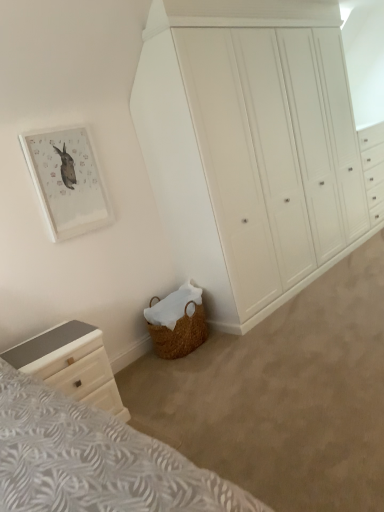
Question: Should I look upward or downward to see white painted wood wardrobe at center, the first chest of drawers viewed from the right?

Choices:
 (A) up
 (B) down

Answer: (A)

Question: From the image's perspective, is white painted wood wardrobe at center, which ranks as the 2th chest of drawers in bottom-to-top order, located above matte white picture frame at upper left?

Choices:
 (A) yes
 (B) no

Answer: (A)

Question: Can you confirm if white painted wood wardrobe at center, which is counted as the 1th chest of drawers, starting from the top, is positioned to the right of matte white picture frame at upper left?

Choices:
 (A) no
 (B) yes

Answer: (B)

Question: Is white painted wood wardrobe at center, which ranks as the 2th chest of drawers in left-to-right order, far from matte white picture frame at upper left?

Choices:
 (A) no
 (B) yes

Answer: (B)

Question: Does white painted wood wardrobe at center, which ranks as the 2th chest of drawers in left-to-right order, lie in front of matte white picture frame at upper left?

Choices:
 (A) no
 (B) yes

Answer: (B)

Question: Is matte white picture frame at upper left surrounded by white painted wood wardrobe at center, which is counted as the 1th chest of drawers, starting from the top?

Choices:
 (A) no
 (B) yes

Answer: (A)

Question: Is white painted wood wardrobe at center, which appears as the 1th chest of drawers when viewed from the back, facing away from matte white picture frame at upper left?

Choices:
 (A) no
 (B) yes

Answer: (A)

Question: Considering the relative sizes of white painted wood wardrobe at center, the first chest of drawers viewed from the right, and white glossy chest of drawers at lower left, arranged as the 2th chest of drawers when viewed from the back, in the image provided, is white painted wood wardrobe at center, the first chest of drawers viewed from the right, shorter than white glossy chest of drawers at lower left, arranged as the 2th chest of drawers when viewed from the back,?

Choices:
 (A) no
 (B) yes

Answer: (A)

Question: From the image's perspective, is white painted wood wardrobe at center, the first chest of drawers viewed from the right, located beneath white glossy chest of drawers at lower left, which is the 1th chest of drawers from front to back?

Choices:
 (A) yes
 (B) no

Answer: (B)

Question: Is white painted wood wardrobe at center, which appears as the 1th chest of drawers when viewed from the back, not close to white glossy chest of drawers at lower left, which is the 1th chest of drawers from front to back?

Choices:
 (A) no
 (B) yes

Answer: (B)

Question: Is white painted wood wardrobe at center, the first chest of drawers viewed from the right, thinner than white glossy chest of drawers at lower left, which ranks as the first chest of drawers in left-to-right order?

Choices:
 (A) yes
 (B) no

Answer: (B)

Question: From the image's perspective, is white painted wood wardrobe at center, placed as the second chest of drawers when sorted from front to back, on top of white glossy chest of drawers at lower left, the 2th chest of drawers from the right?

Choices:
 (A) yes
 (B) no

Answer: (A)

Question: Is white painted wood wardrobe at center, which is counted as the 1th chest of drawers, starting from the top, taller than white glossy chest of drawers at lower left, the 2th chest of drawers from the right?

Choices:
 (A) no
 (B) yes

Answer: (B)

Question: Is white glossy chest of drawers at lower left, which is the 1th chest of drawers from front to back, wider than white painted wood wardrobe at center, which ranks as the 2th chest of drawers in bottom-to-top order?

Choices:
 (A) yes
 (B) no

Answer: (B)